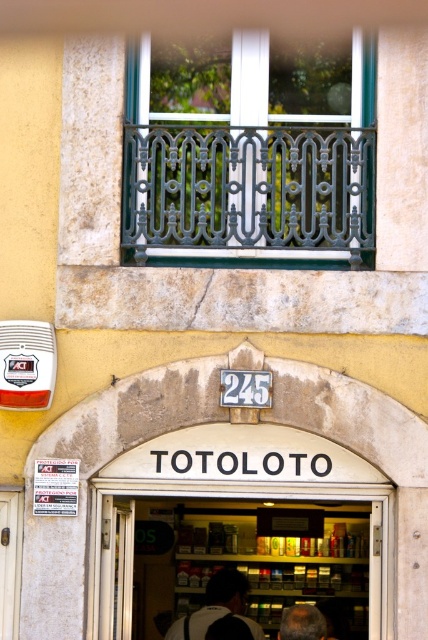
You are a delivery person holding a dark gray backpack at center and need to enter the wooden door at lower left. Can you fit through the doorway?

The wooden door at lower left is smaller than the dark gray backpack at center, so the backpack may not fit through the doorway. Consider checking if the door can be opened wider or if the backpack can be adjusted.